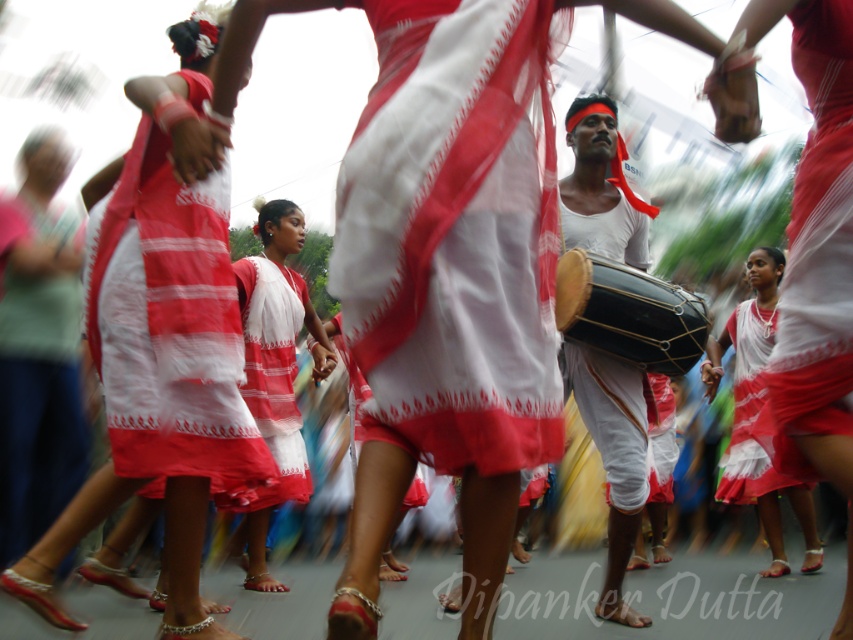
You are a photographer standing at the center of the scene. You want to take a photo of the white matte drum at center. Where should you aim your camera to capture the drum in the frame?

You should aim your camera at point (614, 458) to capture the white matte drum at center.

You are a photographer trying to capture the entire scene of the cultural procession. You notice the white matte drum at center and the white cotton saree at lower right. Which object should you adjust your camera angle to include first if one is blocking the other?

The white matte drum at center is positioned under the white cotton saree at lower right, so you should adjust your angle to include the white cotton saree at lower right first since it is above and might be blocking the drum below.

You are a photographer positioned at the center of the scene. You want to capture a closeup shot of the matte white dress at center. Which direction should you point your camera?

The matte white dress at center is located at point 0.533 on the x axis and 0.192 on the y axis. Since you are at the center of the scene, you should point your camera slightly to the right and downward to capture the matte white dress at center.